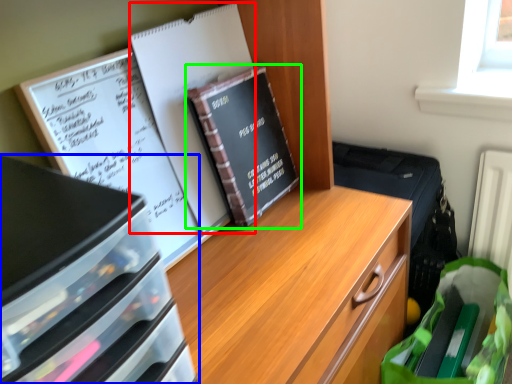
Question: Which object is positioned closest to journal (highlighted by a red box)? Select from desk (highlighted by a blue box) and book (highlighted by a green box).

Choices:
 (A) desk
 (B) book

Answer: (B)